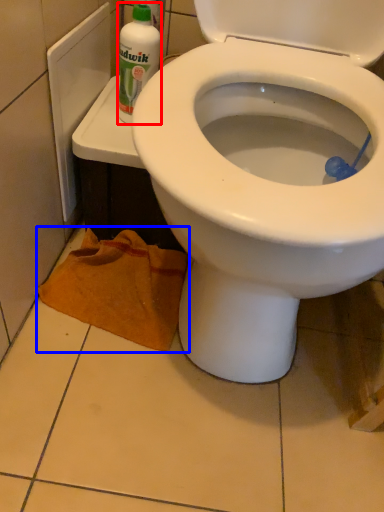
Question: Which point is closer to the camera, cleaning product (highlighted by a red box) or material (highlighted by a blue box)?

Choices:
 (A) cleaning product
 (B) material

Answer: (A)